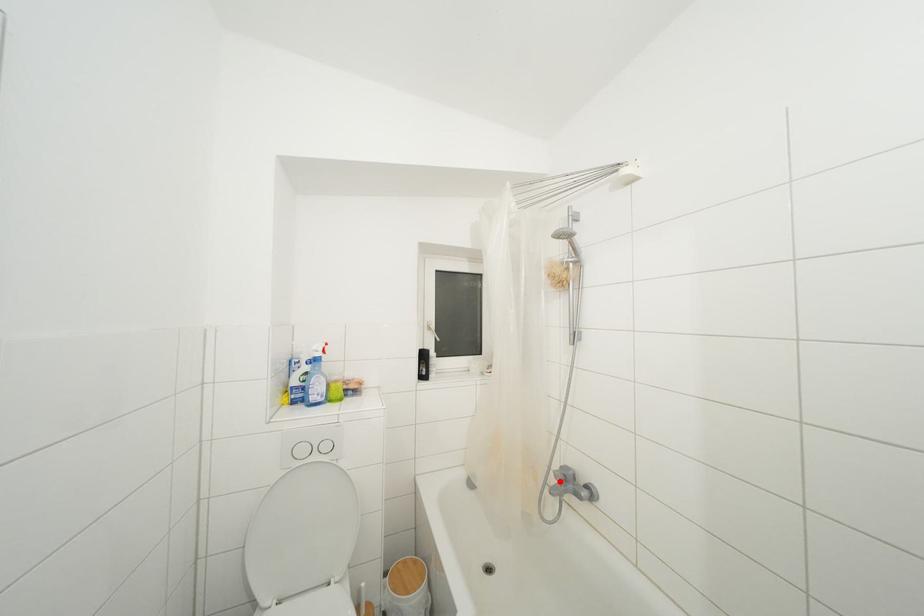
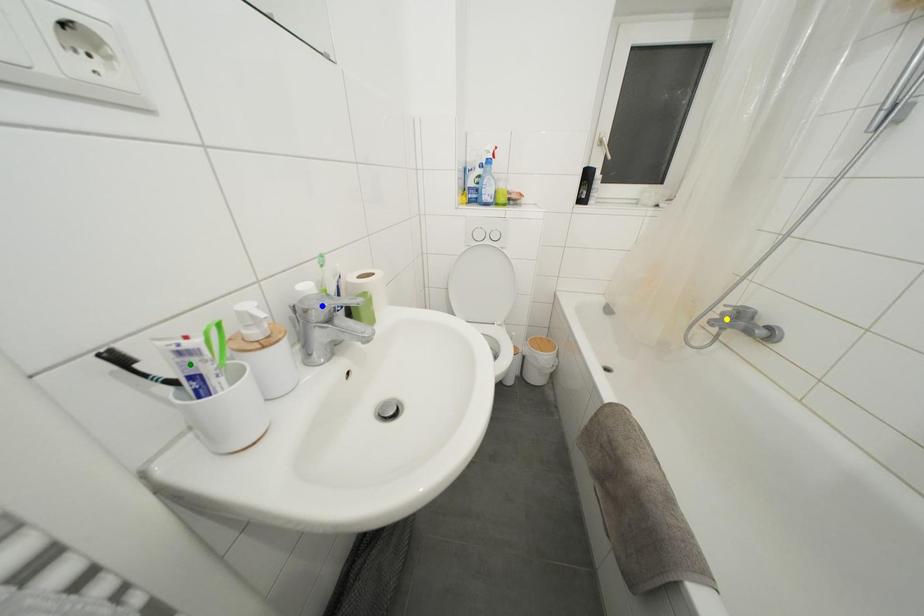
Question: I am providing you with two images of the same scene from different viewpoints. A red point is marked on the first image. You are given multiple points on the second image. Which spot in image 2 lines up with the point in image 1?

Choices:
 (A) green point
 (B) blue point
 (C) yellow point

Answer: (C)